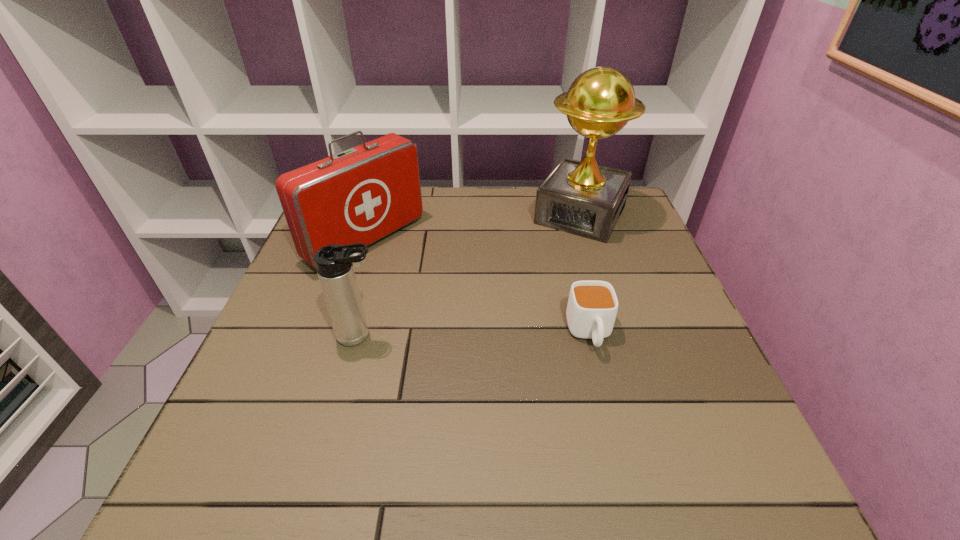
You are a GUI agent. You are given a task and a screenshot of the screen. Output one action in this format:
    pyautogui.click(x=<x>, y=<y>)
    Task: Click on the free region located on the side of the second tallest object with the first aid cross symbol
    This screenshot has width=960, height=540.
    Given the screenshot: What is the action you would take?
    pyautogui.click(x=437, y=288)

The image size is (960, 540). Find the location of `vacant space located on the side of the second tallest object with the first aid cross symbol`. vacant space located on the side of the second tallest object with the first aid cross symbol is located at coordinates (507, 335).

Locate an element on the screen. award at the far edge is located at coordinates (583, 198).

You are a GUI agent. You are given a task and a screenshot of the screen. Output one action in this format:
    pyautogui.click(x=<x>, y=<y>)
    Task: Click on the first-aid kit located in the far edge section of the desktop
    This screenshot has height=540, width=960.
    Given the screenshot: What is the action you would take?
    pyautogui.click(x=360, y=195)

Find the location of a particular element. The width and height of the screenshot is (960, 540). thermos bottle that is at the left edge is located at coordinates [334, 263].

I want to click on the first-aid kit that is at the left edge, so click(x=360, y=195).

You are a GUI agent. You are given a task and a screenshot of the screen. Output one action in this format:
    pyautogui.click(x=<x>, y=<y>)
    Task: Click on the object situated at the right edge
    This screenshot has height=540, width=960.
    Given the screenshot: What is the action you would take?
    pyautogui.click(x=583, y=198)

I want to click on object present at the far left corner, so click(360, 195).

I want to click on object situated at the far right corner, so click(x=583, y=198).

Locate an element on the screen. free space at the far edge of the desktop is located at coordinates (441, 206).